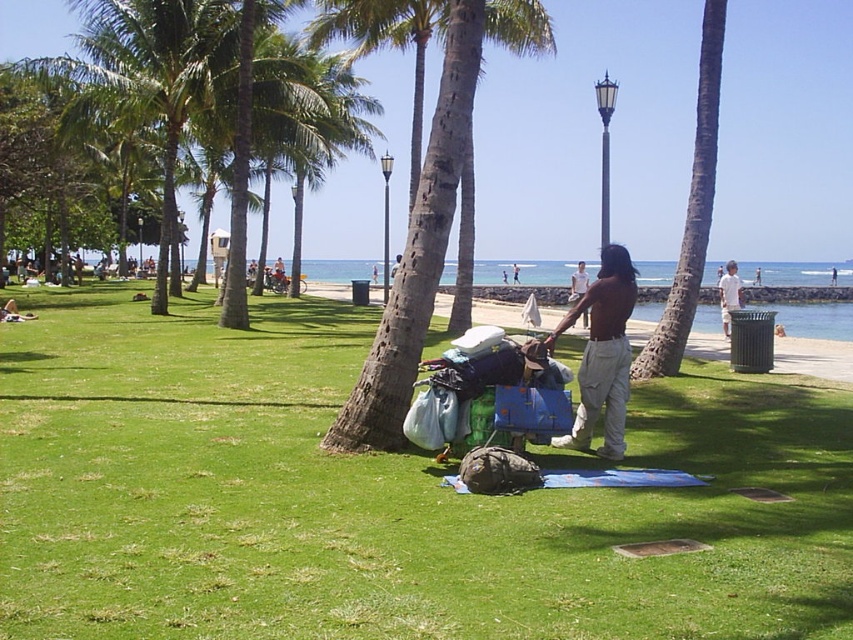
Between light brown cotton shirt at right and brown cotton shirt at center, which one is positioned higher?

brown cotton shirt at center is above.

Is point (738, 285) more distant than point (584, 312)?

Yes, it is behind point (584, 312).

You are a GUI agent. You are given a task and a screenshot of the screen. Output one action in this format:
    pyautogui.click(x=<x>, y=<y>)
    Task: Click on the light brown cotton shirt at right
    Image resolution: width=853 pixels, height=640 pixels.
    Given the screenshot: What is the action you would take?
    point(729,294)

Does point (184, 472) come behind point (453, 22)?

No, (184, 472) is closer to viewer.

Is green grass at center wider than brown rough bark palm tree at center?

Yes, green grass at center is wider than brown rough bark palm tree at center.

Who is more distant from viewer, (125, 394) or (525, 42)?

Positioned behind is point (525, 42).

Where is `green grass at center`? This screenshot has width=853, height=640. green grass at center is located at coordinates (383, 497).

Is point (349, 406) positioned behind point (734, 273)?

No, it is not.

Who is taller, brown rough bark palm tree at center or light brown cotton shirt at right?

brown rough bark palm tree at center is taller.

Locate an element on the screen. brown rough bark palm tree at center is located at coordinates (430, 221).